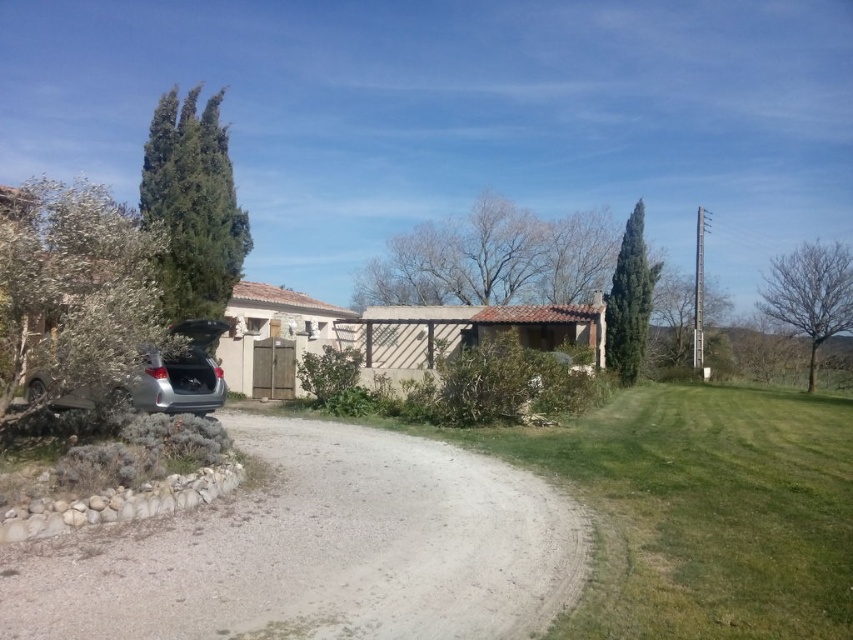
You are planning to park another car of the same size as the satin silver car at left on the gray gravel driveway at lower left. Can you determine if there is enough space based on the given information?

The gray gravel driveway at lower left might be wider than satin silver car at left, so there is a possibility that the driveway can accommodate another car of the same size, but the exact width is uncertain due to the comparative description.

You are standing at the entrance of the house and want to walk to the gray gravel driveway at lower left. Which direction should you head?

The gray gravel driveway at lower left is located at point (318, 550), so you should head towards the lower left direction to reach it.

You are a delivery person with a package that needs to be placed on the gray gravel driveway at lower left. You are currently standing next to the satin silver car at left. Can you walk directly to the driveway without stepping on the grass or the shrubs?

The gray gravel driveway at lower left and satin silver car at left are 2.64 meters apart, so yes, you can walk directly to the driveway without stepping on the grass or shrubs since the distance between them is sufficient for walking.